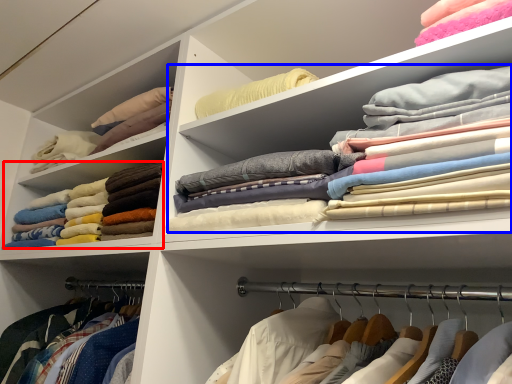
Question: Among these objects, which one is nearest to the camera, clothing (highlighted by a red box) or clothing (highlighted by a blue box)?

Choices:
 (A) clothing
 (B) clothing

Answer: (B)